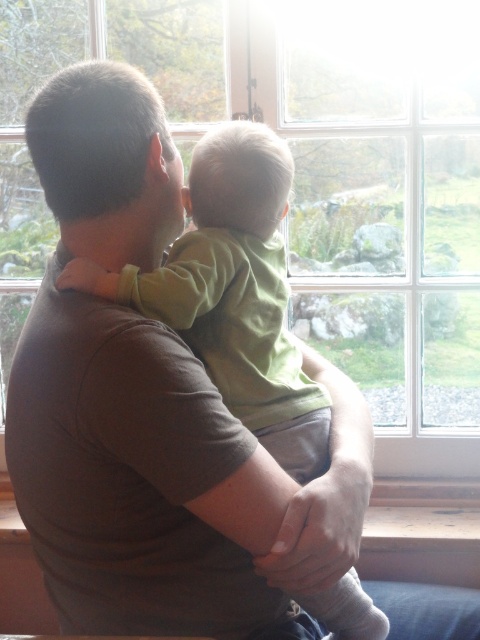
Is point (230, 42) behind point (188, 317)?

Yes.

Who is positioned more to the right, transparent glass window at center or green matte shirt at center?

Positioned to the right is transparent glass window at center.

Is point (372, 195) positioned behind point (268, 422)?

That is True.

At what (x,y) coordinates should I click in order to perform the action: click on transparent glass window at center. Please return your answer as a coordinate pair (x, y). The width and height of the screenshot is (480, 640). Looking at the image, I should click on click(x=310, y=179).